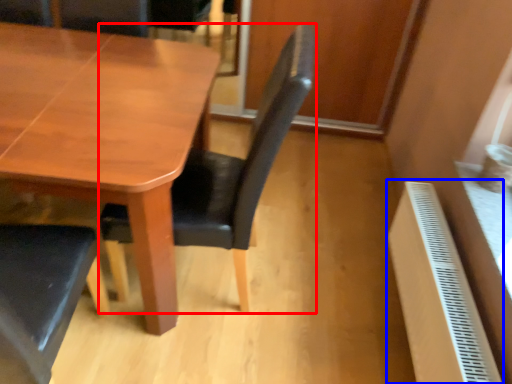
Question: Among these objects, which one is nearest to the camera, chair (highlighted by a red box) or radiator (highlighted by a blue box)?

Choices:
 (A) chair
 (B) radiator

Answer: (A)